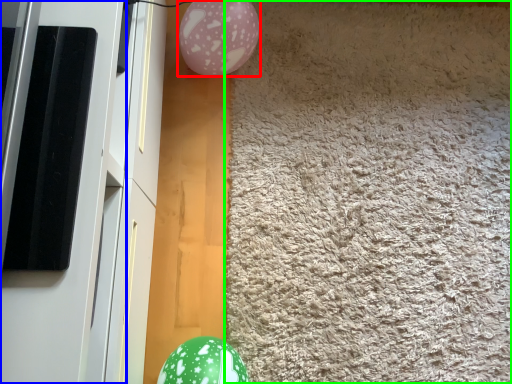
Question: Which object is positioned farthest from balloon (highlighted by a red box)? Select from screen door (highlighted by a blue box) and mat (highlighted by a green box).

Choices:
 (A) screen door
 (B) mat

Answer: (A)